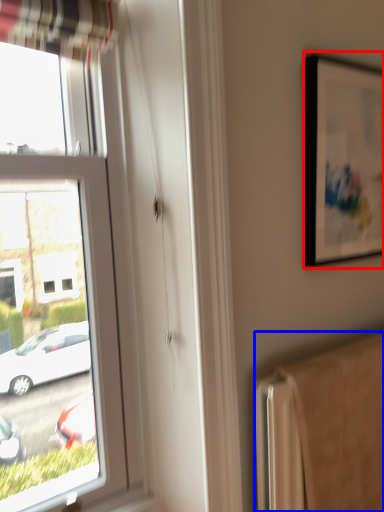
Question: Which point is further to the camera, picture frame (highlighted by a red box) or radiator (highlighted by a blue box)?

Choices:
 (A) picture frame
 (B) radiator

Answer: (A)